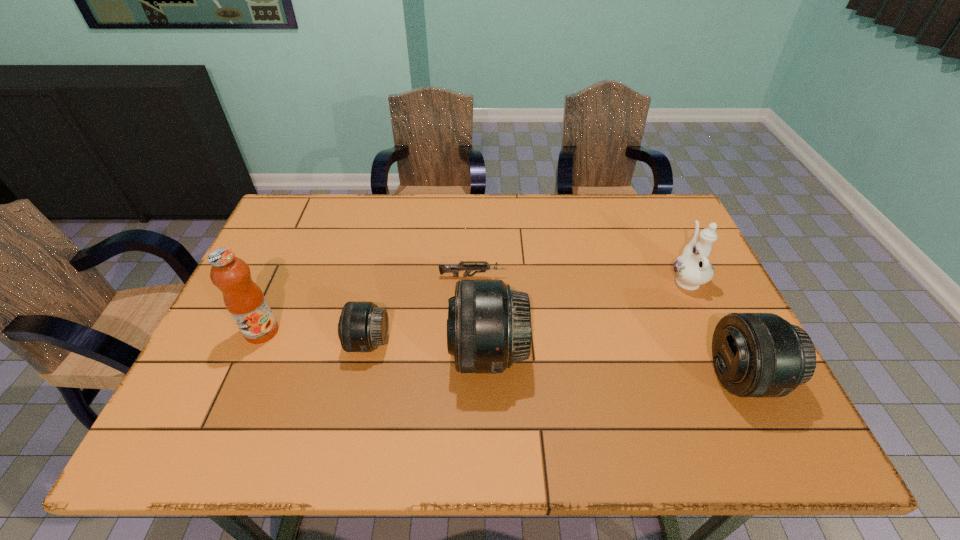
Where is `object that ranks as the closest to the second telephoto lens from right to left`? Image resolution: width=960 pixels, height=540 pixels. object that ranks as the closest to the second telephoto lens from right to left is located at coordinates (454, 269).

This screenshot has width=960, height=540. I want to click on object that is the closest one to the chinaware, so click(755, 354).

Where is `telephoto lens that stands as the closest to the second telephoto lens from right to left`? The height and width of the screenshot is (540, 960). telephoto lens that stands as the closest to the second telephoto lens from right to left is located at coordinates (363, 326).

Locate which telephoto lens is the second closest to the fruit juice. Please provide its 2D coordinates. Your answer should be formatted as a tuple, i.e. [(x, y)], where the tuple contains the x and y coordinates of a point satisfying the conditions above.

[(489, 325)]

Where is `free space that satisfies the following two spatial constraints: 1. aimed along the barrel of the gun; 2. on the front label of the leftmost object`? free space that satisfies the following two spatial constraints: 1. aimed along the barrel of the gun; 2. on the front label of the leftmost object is located at coordinates (471, 332).

The image size is (960, 540). What are the coordinates of `free space that satisfies the following two spatial constraints: 1. at the spout of the chinaware; 2. aimed along the barrel of the shortest object` in the screenshot? It's located at (684, 276).

Find the location of a particular element. This screenshot has width=960, height=540. vacant region that satisfies the following two spatial constraints: 1. aimed along the barrel of the gun; 2. on the front label of the tallest object is located at coordinates 471,332.

Where is `free space that satisfies the following two spatial constraints: 1. aimed along the barrel of the gun; 2. at the spout of the chinaware`? The width and height of the screenshot is (960, 540). free space that satisfies the following two spatial constraints: 1. aimed along the barrel of the gun; 2. at the spout of the chinaware is located at coordinates (472, 279).